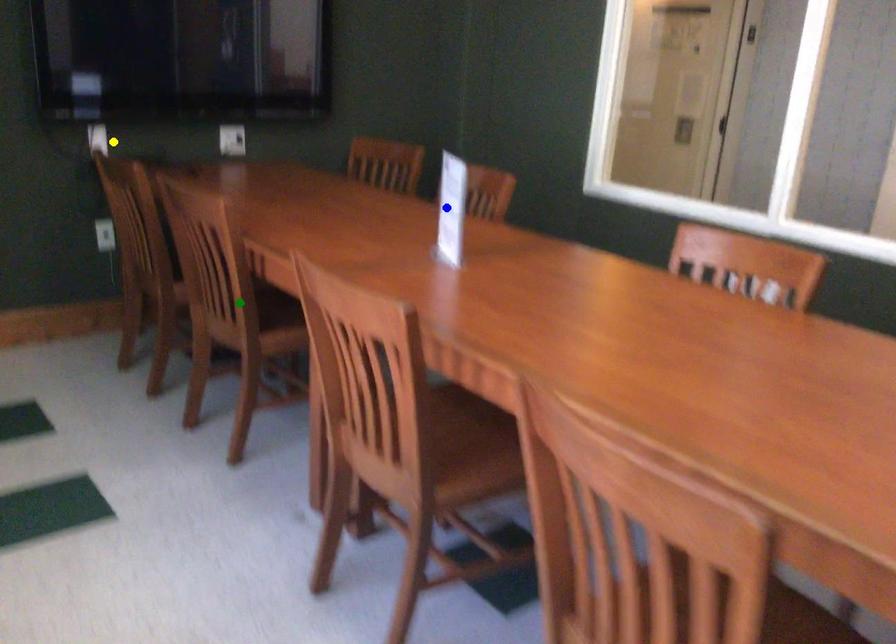
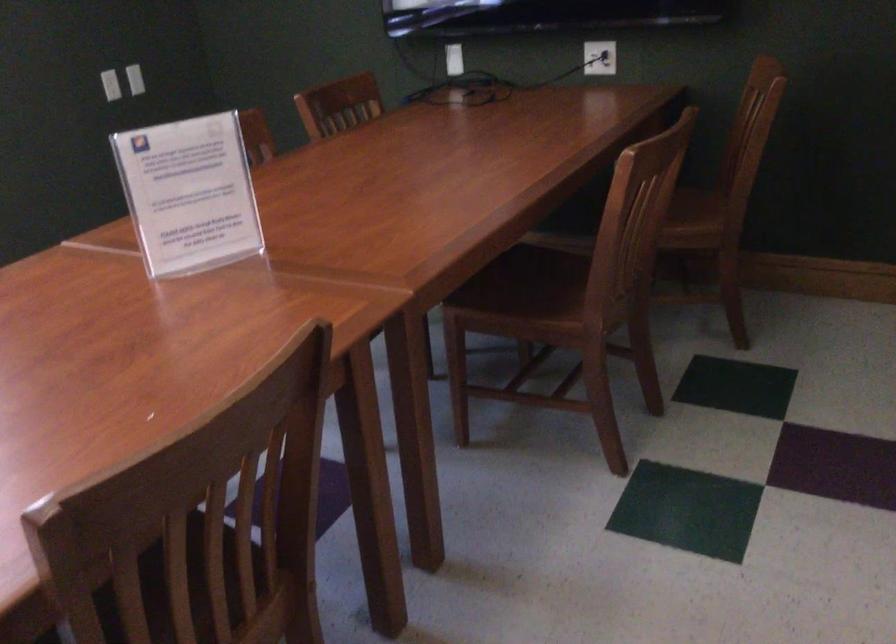
I am providing you with two images of the same scene from different viewpoints. Three points are marked in image1. Which point corresponds to a part or object that is occluded in image2?In image1, three points are marked. Which of them correspond to a part or object that is occluded in image2?Among the three points shown in image1, which one corresponds to a part or object that is no longer visible due to occlusion in image2?

green point